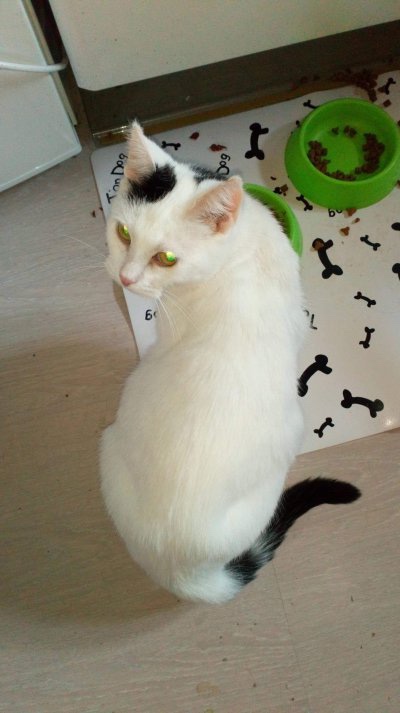
The image size is (400, 713). What are the coordinates of `bowl` in the screenshot? It's located at (299, 242).